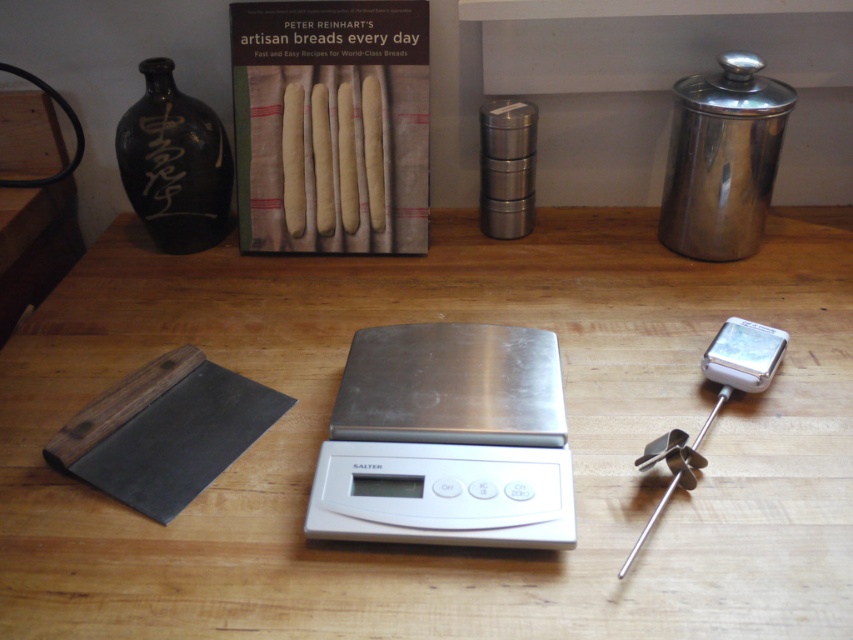
Question: Is silver/stainless steel scale at center positioned in front of matte paper book at center?

Choices:
 (A) yes
 (B) no

Answer: (A)

Question: From the image, what is the correct spatial relationship of wooden table at center in relation to silver/stainless steel scale at center?

Choices:
 (A) left
 (B) right

Answer: (B)

Question: Does wooden table at center appear over matte paper book at center?

Choices:
 (A) no
 (B) yes

Answer: (A)

Question: Among these objects, which one is farthest from the camera?

Choices:
 (A) silver/stainless steel scale at center
 (B) matte paper book at center
 (C) wooden table at center

Answer: (B)

Question: Which of these objects is positioned closest to the silver/stainless steel scale at center?

Choices:
 (A) silver metallic thermometer at right
 (B) wooden table at center
 (C) matte paper book at center

Answer: (B)

Question: Which point appears closest to the camera in this image?

Choices:
 (A) (438, 394)
 (B) (310, 484)

Answer: (B)